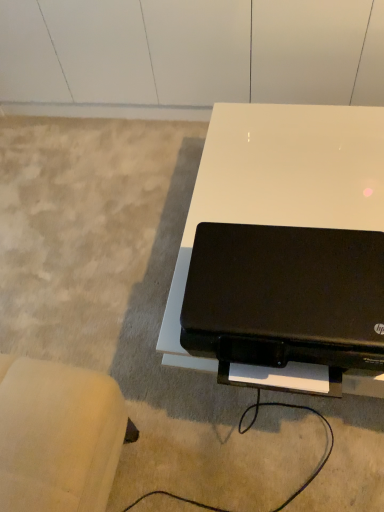
Identify the location of free point above black matte laptop at lower right (from a real-world perspective). (293, 282).